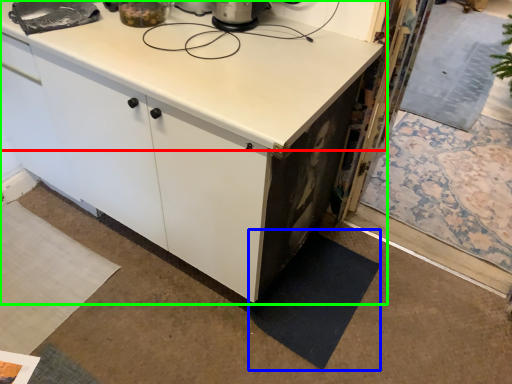
Question: Based on their relative distances, which object is nearer to countertop (highlighted by a red box)? Choose from mat (highlighted by a blue box) and cabinetry (highlighted by a green box).

Choices:
 (A) mat
 (B) cabinetry

Answer: (B)